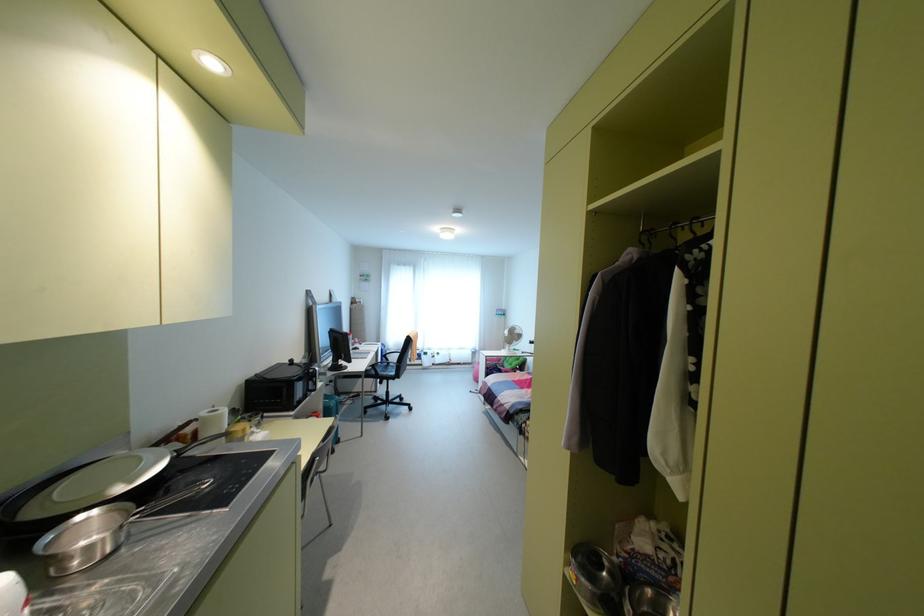
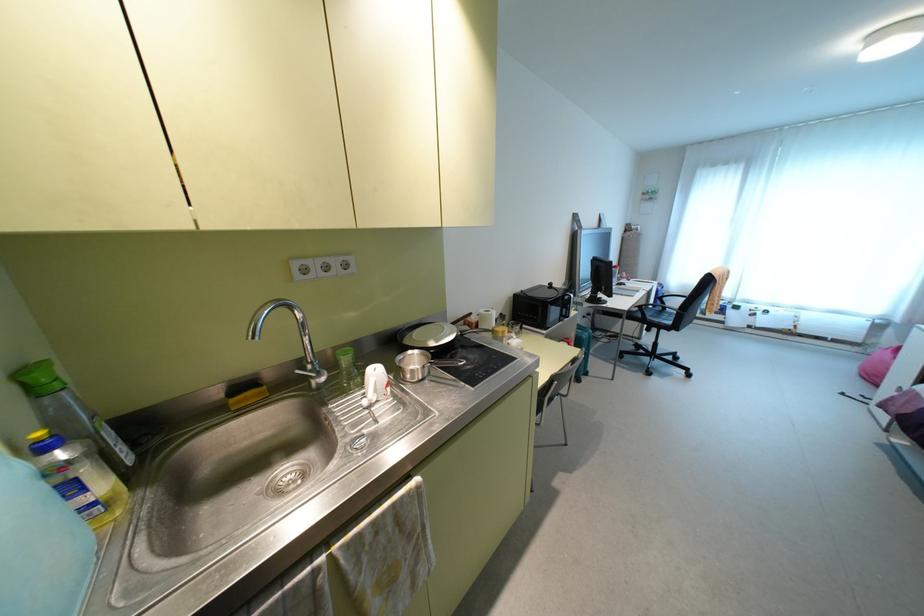
In the second image, find the point that corresponds to [319,384] in the first image.

(573, 313)